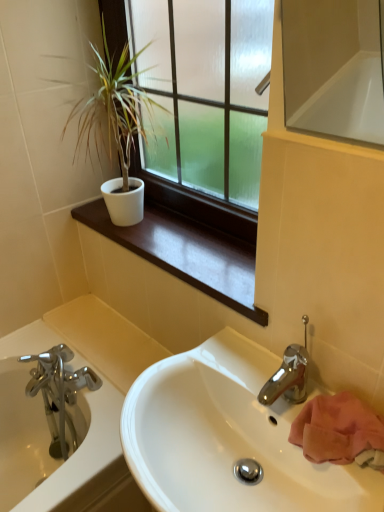
Question: From a real-world perspective, is matte glass window at upper center on top of brushed metal bathtub at lower left?

Choices:
 (A) no
 (B) yes

Answer: (B)

Question: Is matte glass window at upper center looking in the opposite direction of brushed metal bathtub at lower left?

Choices:
 (A) no
 (B) yes

Answer: (A)

Question: Can you confirm if matte glass window at upper center is taller than brushed metal bathtub at lower left?

Choices:
 (A) no
 (B) yes

Answer: (B)

Question: Would you say matte glass window at upper center is a long distance from brushed metal bathtub at lower left?

Choices:
 (A) no
 (B) yes

Answer: (A)

Question: Is matte glass window at upper center at the right side of brushed metal bathtub at lower left?

Choices:
 (A) yes
 (B) no

Answer: (A)

Question: Does matte glass window at upper center have a larger size compared to brushed metal bathtub at lower left?

Choices:
 (A) yes
 (B) no

Answer: (A)

Question: Is white matte pot at upper left facing away from white matte window sill at upper center?

Choices:
 (A) no
 (B) yes

Answer: (A)

Question: Considering the relative sizes of white matte pot at upper left and white matte window sill at upper center in the image provided, is white matte pot at upper left shorter than white matte window sill at upper center?

Choices:
 (A) yes
 (B) no

Answer: (B)

Question: Does white matte pot at upper left turn towards white matte window sill at upper center?

Choices:
 (A) no
 (B) yes

Answer: (A)

Question: Is white matte pot at upper left at the right side of white matte window sill at upper center?

Choices:
 (A) yes
 (B) no

Answer: (B)

Question: From a real-world perspective, is white matte pot at upper left on white matte window sill at upper center?

Choices:
 (A) no
 (B) yes

Answer: (B)

Question: Would you say white matte pot at upper left contains white matte window sill at upper center?

Choices:
 (A) yes
 (B) no

Answer: (B)

Question: Can you confirm if matte glass window at upper center is wider than white matte window sill at upper center?

Choices:
 (A) no
 (B) yes

Answer: (A)